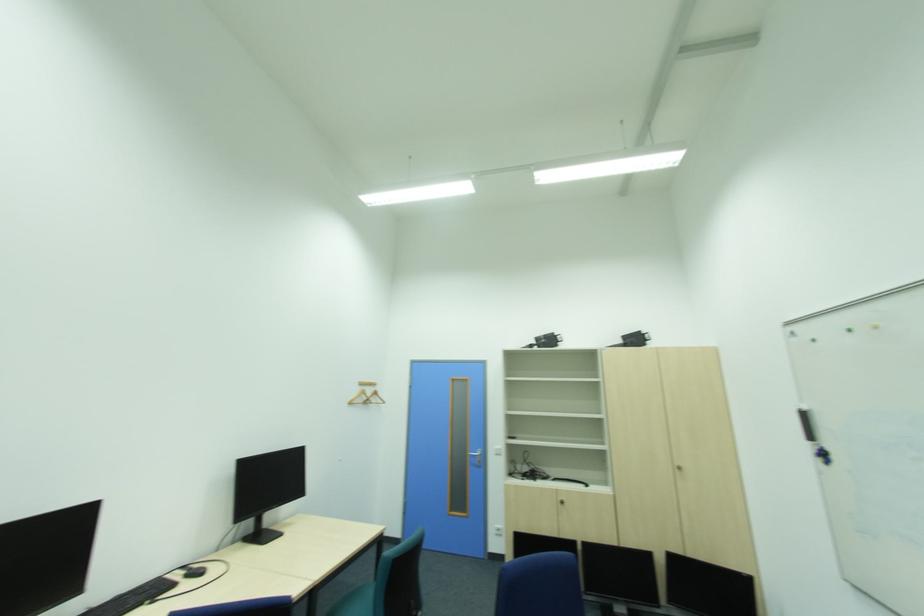
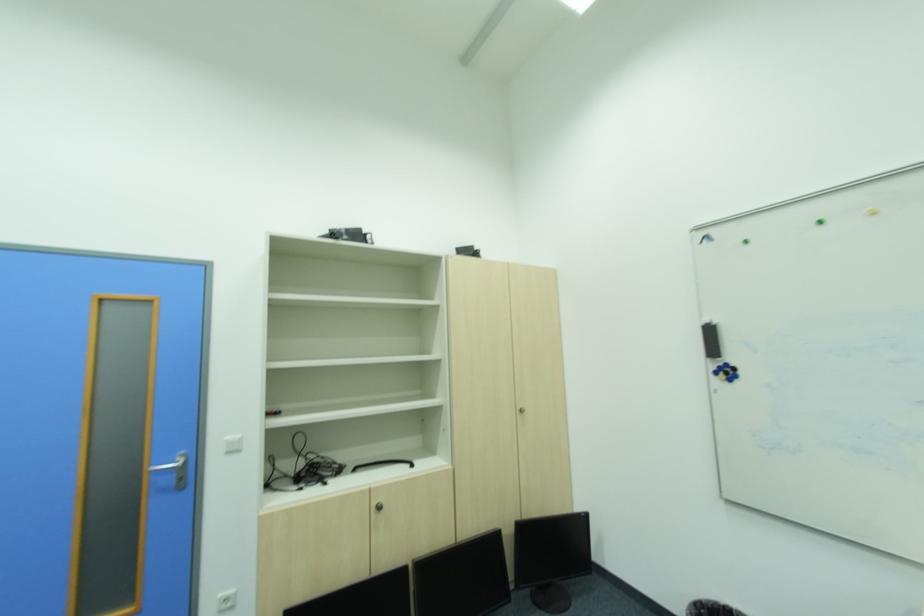
In the second image, find the point that corresponds to pixel 678 559 in the first image.

(531, 531)